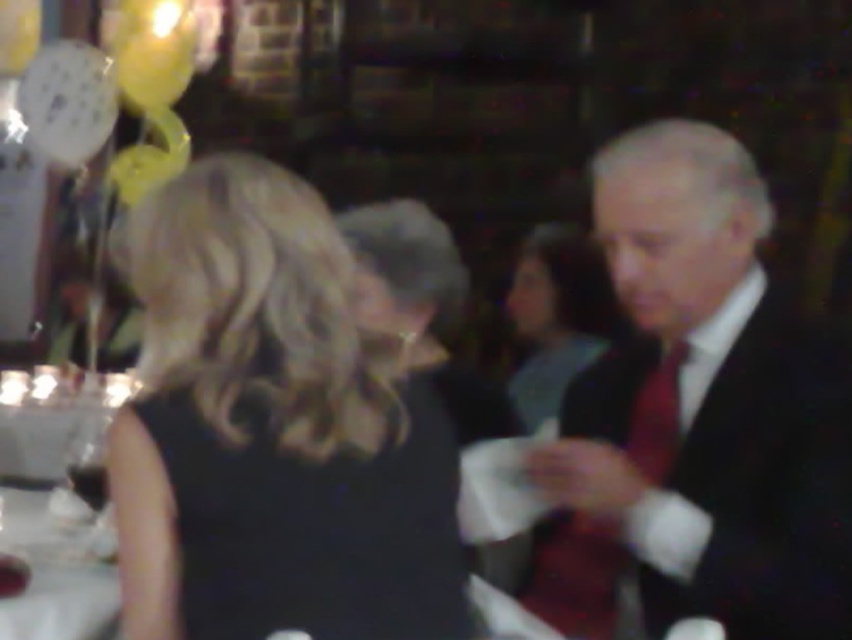
Is black silk dress at center bigger than matte black suit at right?

Yes.

Who is higher up, black silk dress at center or matte black suit at right?

matte black suit at right is higher up.

Where is `black silk dress at center`? black silk dress at center is located at coordinates (273, 429).

You are a GUI agent. You are given a task and a screenshot of the screen. Output one action in this format:
    pyautogui.click(x=<x>, y=<y>)
    Task: Click on the black silk dress at center
    The image size is (852, 640).
    Given the screenshot: What is the action you would take?
    pyautogui.click(x=273, y=429)

Who is positioned more to the left, smooth black dress at center or white glossy table at lower left?

white glossy table at lower left

Is smooth black dress at center above white glossy table at lower left?

Yes, smooth black dress at center is above white glossy table at lower left.

Is point (599, 310) behind point (10, 497)?

Yes, it is.

Locate an element on the screen. The width and height of the screenshot is (852, 640). smooth black dress at center is located at coordinates [557, 316].

Does black silk dress at center have a greater width compared to white glossy table at lower left?

Yes, black silk dress at center is wider than white glossy table at lower left.

Can you confirm if black silk dress at center is shorter than white glossy table at lower left?

In fact, black silk dress at center may be taller than white glossy table at lower left.

The height and width of the screenshot is (640, 852). In order to click on black silk dress at center in this screenshot , I will do `click(273, 429)`.